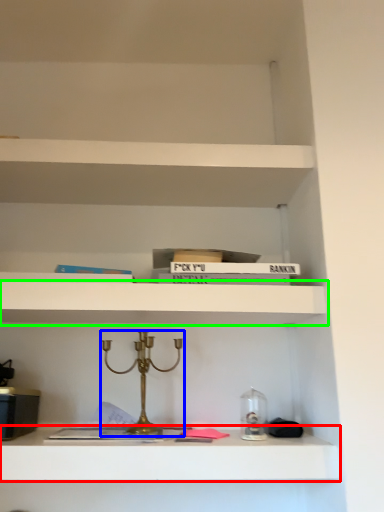
Question: Considering the real-world distances, which object is farthest from shelf (highlighted by a red box)? candle holder (highlighted by a blue box) or shelf (highlighted by a green box)?

Choices:
 (A) candle holder
 (B) shelf

Answer: (B)